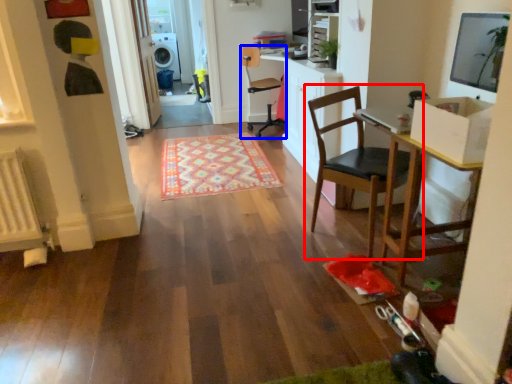
Question: Which object is further to the camera taking this photo, chair (highlighted by a red box) or chair (highlighted by a blue box)?

Choices:
 (A) chair
 (B) chair

Answer: (B)